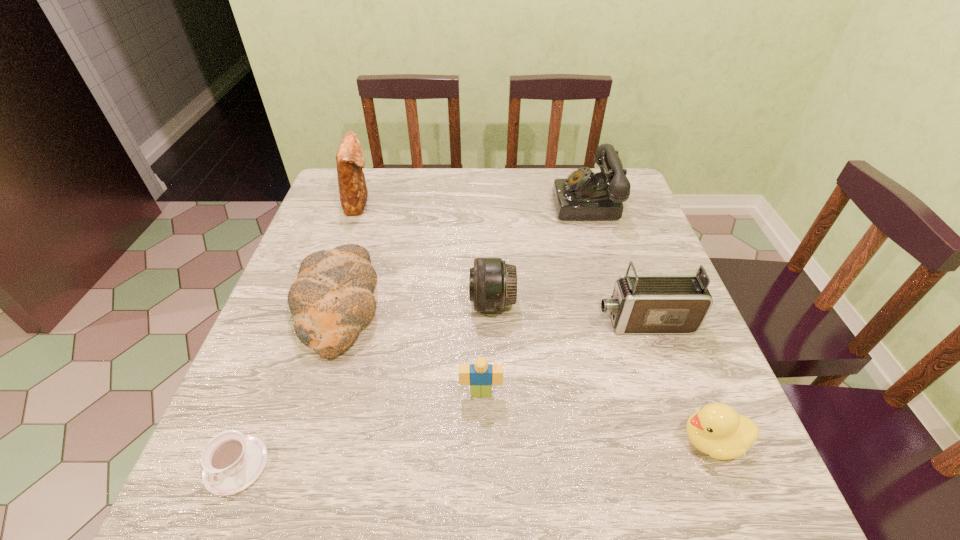
This screenshot has height=540, width=960. I want to click on clutch bag, so click(x=350, y=160).

Image resolution: width=960 pixels, height=540 pixels. What are the coordinates of `telephone` in the screenshot? It's located at (583, 195).

Where is `camcorder`? camcorder is located at coordinates (642, 304).

Identify the location of telephoto lens. This screenshot has width=960, height=540. (493, 284).

Where is `bread`? This screenshot has height=540, width=960. bread is located at coordinates (332, 298).

Image resolution: width=960 pixels, height=540 pixels. I want to click on the third nearest object, so click(480, 376).

In order to click on duckling in this screenshot , I will do `click(716, 429)`.

This screenshot has width=960, height=540. Find the location of `the shortest object`. the shortest object is located at coordinates (231, 461).

Identify the location of vacant region located on the open side of the clutch bag. The height and width of the screenshot is (540, 960). (501, 202).

Where is `free region located on the dial of the telephone`? free region located on the dial of the telephone is located at coordinates [x=491, y=204].